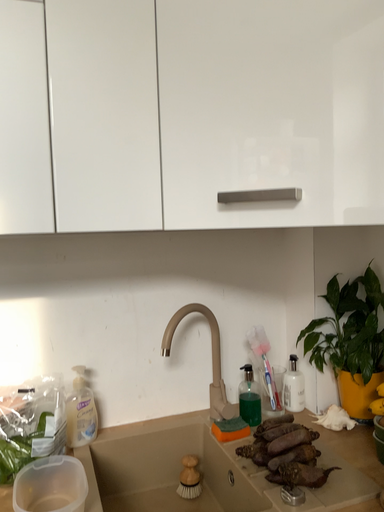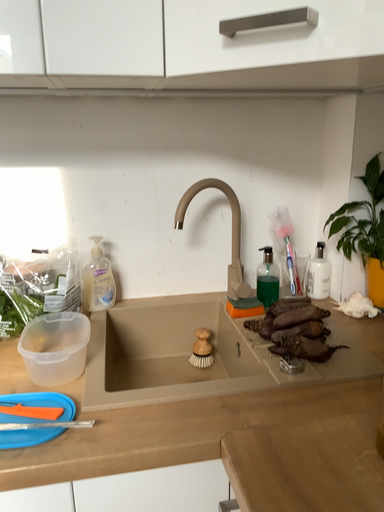
Question: How did the camera likely rotate when shooting the video?

Choices:
 (A) rotated left
 (B) rotated right

Answer: (A)